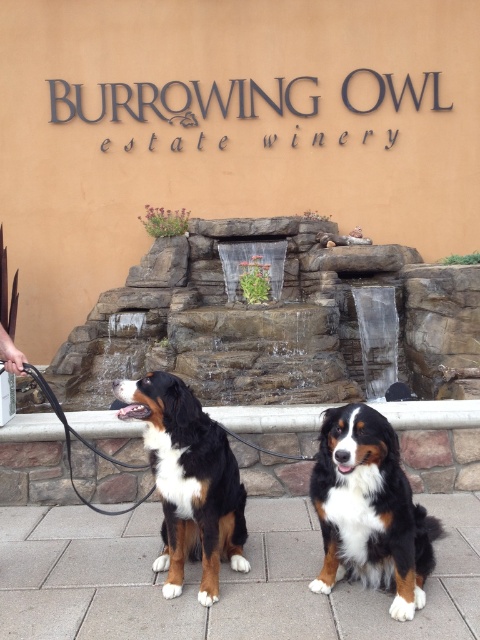
Question: Considering the relative positions of tri-colored fur dog at center and black leather leash at left in the image provided, where is tri-colored fur dog at center located with respect to black leather leash at left?

Choices:
 (A) right
 (B) left

Answer: (A)

Question: Observing the image, what is the correct spatial positioning of black rubber leash at left in reference to black leather leash at left?

Choices:
 (A) above
 (B) below

Answer: (B)

Question: Among these points, which one is farthest from the camera?

Choices:
 (A) (160, 417)
 (B) (132, 467)
 (C) (398, 564)
 (D) (81, 442)

Answer: (D)

Question: Can you confirm if tri-colored fur dog at center is thinner than black rubber leash at left?

Choices:
 (A) yes
 (B) no

Answer: (B)

Question: Which point appears farthest from the camera in this image?

Choices:
 (A) (67, 422)
 (B) (230, 524)

Answer: (A)

Question: Which point is closer to the camera taking this photo?

Choices:
 (A) (67, 444)
 (B) (351, 524)
 (C) (172, 401)

Answer: (B)